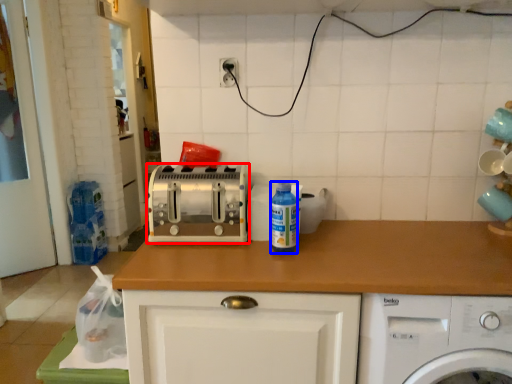
Question: Among these objects, which one is nearest to the camera, toaster (highlighted by a red box) or bottle (highlighted by a blue box)?

Choices:
 (A) toaster
 (B) bottle

Answer: (A)